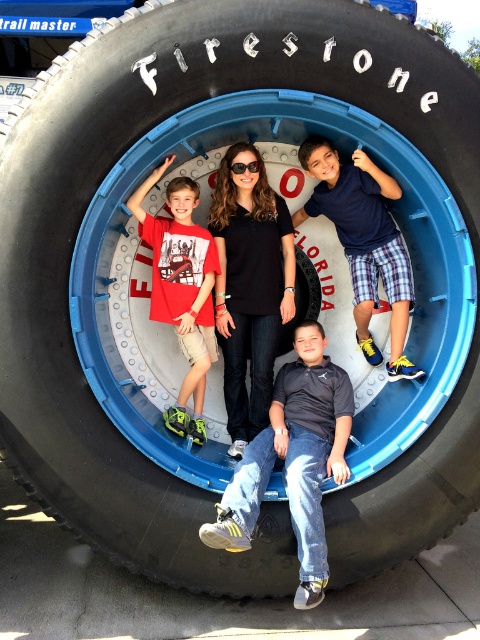
Question: Among these objects, which one is farthest from the camera?

Choices:
 (A) black matte shirt at center
 (B) dark gray fabric shirt at center
 (C) blue plaid shorts at lower right
 (D) matte red t-shirt at left

Answer: (A)

Question: Among these points, which one is farthest from the camera?

Choices:
 (A) (375, 172)
 (B) (204, 342)
 (C) (251, 481)
 (D) (228, 179)

Answer: (B)

Question: Can you confirm if black matte shirt at center is positioned to the right of matte red t-shirt at left?

Choices:
 (A) no
 (B) yes

Answer: (B)

Question: Which of the following is the farthest from the observer?

Choices:
 (A) (205, 264)
 (B) (367, 273)
 (C) (309, 531)
 (D) (228, 426)

Answer: (D)

Question: Is dark gray fabric shirt at center positioned in front of blue plaid shorts at lower right?

Choices:
 (A) yes
 (B) no

Answer: (A)

Question: Can you confirm if black matte shirt at center is wider than matte red t-shirt at left?

Choices:
 (A) no
 (B) yes

Answer: (B)